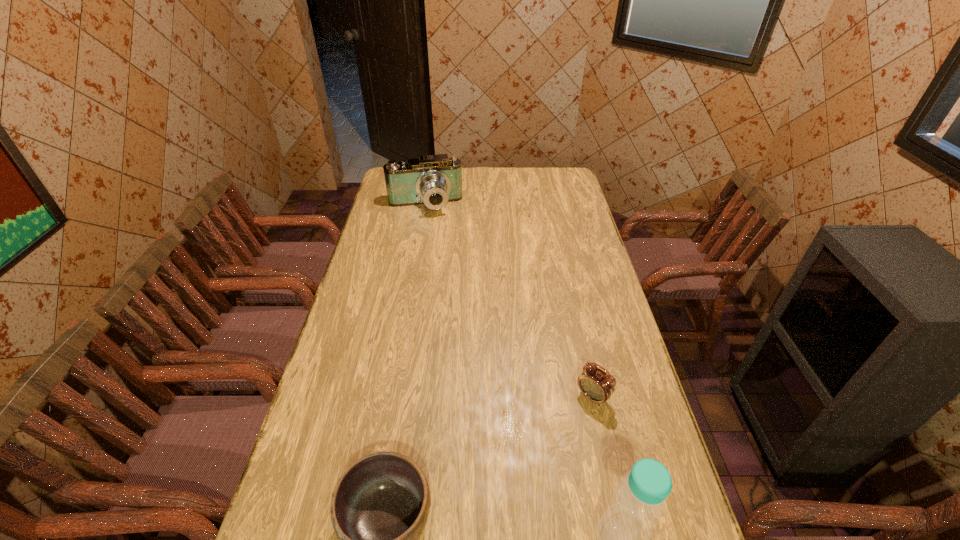
Identify the location of free space on the desktop that is between the bowl and the bottle and is positioned on the front-facing side of the farthest object. (476, 527).

Identify the location of free space on the desktop that is between the bowl and the bottle and is positioned on the face of the alarm clock. (477, 527).